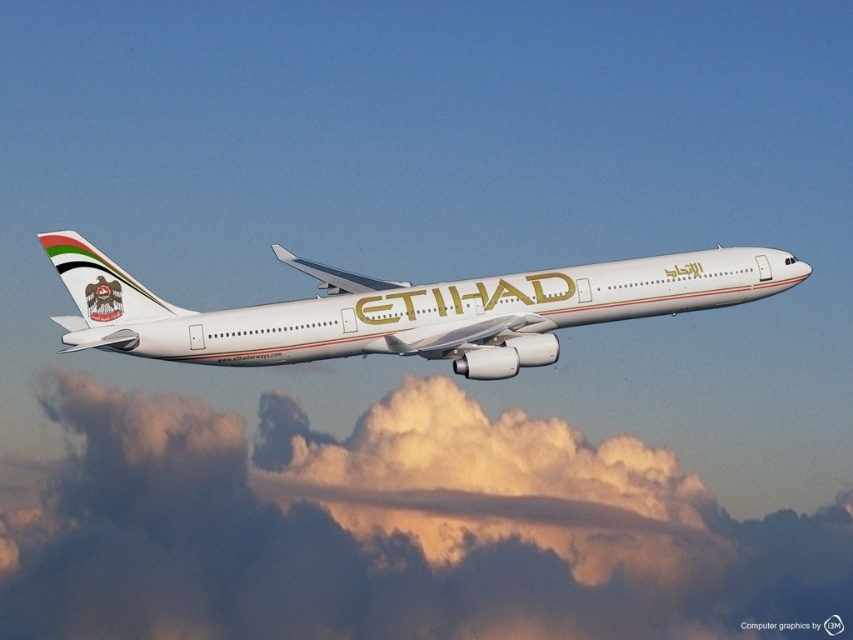
Question: Which point appears farthest from the camera in this image?

Choices:
 (A) (741, 572)
 (B) (96, 342)

Answer: (A)

Question: Can you confirm if white fluffy cloud at upper center is wider than white glossy airplane at center?

Choices:
 (A) no
 (B) yes

Answer: (B)

Question: Can you confirm if white fluffy cloud at upper center is smaller than white glossy airplane at center?

Choices:
 (A) no
 (B) yes

Answer: (A)

Question: Can you confirm if white fluffy cloud at upper center is positioned to the right of white glossy airplane at center?

Choices:
 (A) yes
 (B) no

Answer: (A)